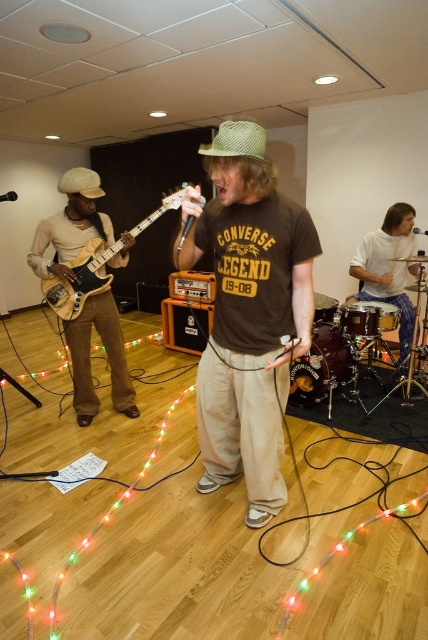
Question: Among these points, which one is farthest from the camera?

Choices:
 (A) (112, 253)
 (B) (338, 364)
 (C) (401, 321)
 (D) (92, 324)

Answer: (D)

Question: Is brown cotton t-shirt at center positioned before shiny black drum set at center?

Choices:
 (A) yes
 (B) no

Answer: (A)

Question: Is brown cotton t-shirt at center to the left of white fabric drum at right from the viewer's perspective?

Choices:
 (A) yes
 (B) no

Answer: (A)

Question: Does white fabric drum at right come behind shiny black drum set at center?

Choices:
 (A) no
 (B) yes

Answer: (B)

Question: Among these objects, which one is nearest to the camera?

Choices:
 (A) brown cotton t-shirt at center
 (B) white fabric drum at right
 (C) matte wood electric guitar at left

Answer: (A)

Question: Estimate the real-world distances between objects in this image. Which object is farther from the matte wood guitar at left?

Choices:
 (A) brown cotton t-shirt at center
 (B) white fabric drum at right
 (C) shiny black drum set at center

Answer: (B)